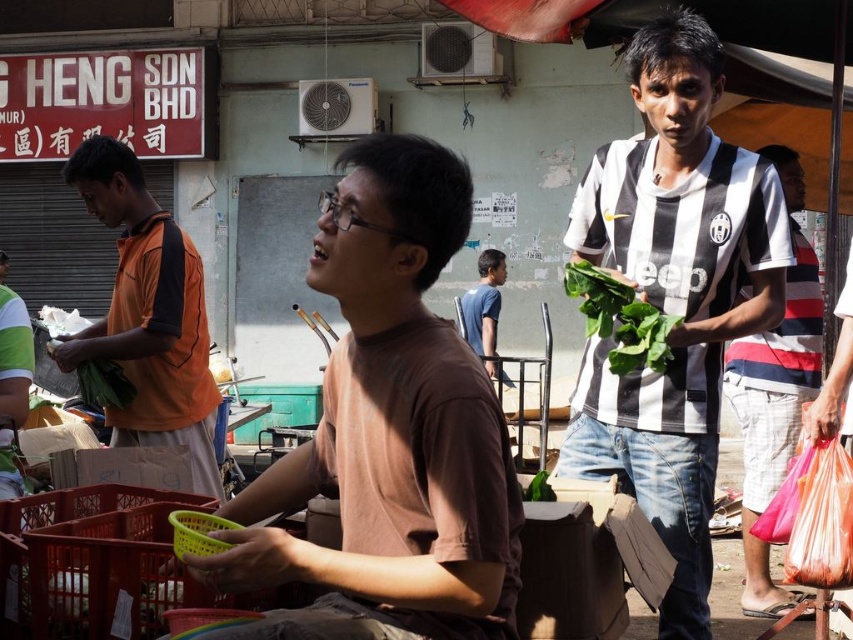
Question: Can you confirm if black and white striped shirt at center is smaller than orange fabric shirt at left?

Choices:
 (A) yes
 (B) no

Answer: (A)

Question: Can you confirm if orange fabric shirt at left is bigger than blue matte shirt at center?

Choices:
 (A) no
 (B) yes

Answer: (A)

Question: Among these points, which one is nearest to the camera?

Choices:
 (A) (488, 275)
 (B) (770, 260)
 (C) (776, 604)

Answer: (B)

Question: Based on their relative distances, which object is farther from the striped jersey at center?

Choices:
 (A) blue matte shirt at center
 (B) black and white striped shirt at center
 (C) green leafy vegetable at center

Answer: (A)

Question: Which point is closer to the camera taking this photo?

Choices:
 (A) (149, 394)
 (B) (708, 248)
 (C) (505, 381)
 (D) (352, 573)

Answer: (D)

Question: Observing the image, what is the correct spatial positioning of orange fabric shirt at left in reference to blue matte shirt at center?

Choices:
 (A) right
 (B) left

Answer: (B)